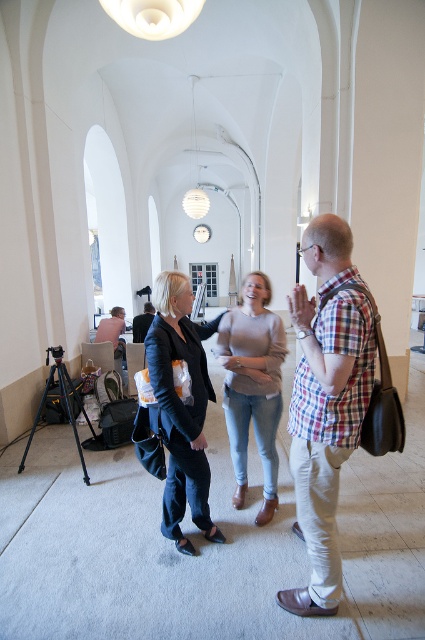
Is dark blue fabric jacket at center further to the viewer compared to matte black camera at center?

No, it is in front of matte black camera at center.

Who is more forward, (161, 416) or (122, 308)?

Point (161, 416) is in front.

Which is in front, point (178, 444) or point (96, 332)?

Point (178, 444) is in front.

Identify the location of dark blue fabric jacket at center. The height and width of the screenshot is (640, 425). (181, 406).

Can you confirm if plaid cotton shirt at center is thinner than matte black camera at center?

Yes, plaid cotton shirt at center is thinner than matte black camera at center.

Find the location of a particular element. Image resolution: width=425 pixels, height=640 pixels. plaid cotton shirt at center is located at coordinates (325, 429).

What do you see at coordinates (325, 429) in the screenshot? Image resolution: width=425 pixels, height=640 pixels. I see `plaid cotton shirt at center` at bounding box center [325, 429].

You are a GUI agent. You are given a task and a screenshot of the screen. Output one action in this format:
    pyautogui.click(x=<x>, y=<y>)
    Task: Click on the plaid cotton shirt at center
    Image resolution: width=425 pixels, height=640 pixels.
    Given the screenshot: What is the action you would take?
    pyautogui.click(x=325, y=429)

Does light gray sweater at center lie in front of matte black camera at center?

Yes, light gray sweater at center is in front of matte black camera at center.

Does light gray sweater at center have a smaller size compared to matte black camera at center?

Incorrect, light gray sweater at center is not smaller in size than matte black camera at center.

At what (x,y) coordinates should I click in order to perform the action: click on light gray sweater at center. Please return your answer as a coordinate pair (x, y). This screenshot has width=425, height=640. Looking at the image, I should click on (252, 385).

Image resolution: width=425 pixels, height=640 pixels. In order to click on light gray sweater at center in this screenshot , I will do `click(252, 385)`.